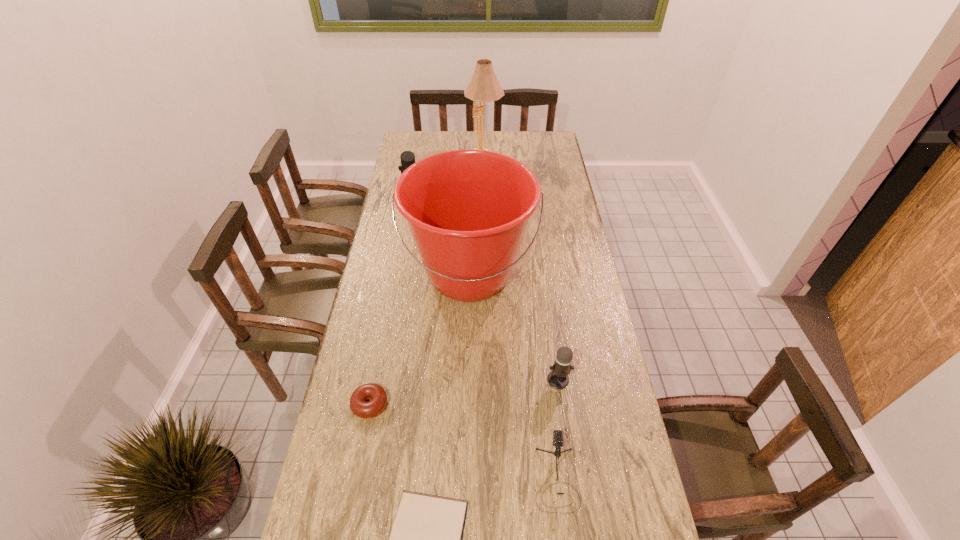
Locate an element on the screen. This screenshot has width=960, height=540. the tallest object is located at coordinates (483, 87).

Image resolution: width=960 pixels, height=540 pixels. I want to click on the farthest object, so click(483, 87).

At what (x,y) coordinates should I click in order to perform the action: click on the second tallest object. Please return your answer as a coordinate pair (x, y). Looking at the image, I should click on (467, 210).

Identify the location of the fifth nearest object. (467, 210).

At what (x,y) coordinates should I click in order to perform the action: click on the sixth nearest object. Please return your answer as a coordinate pair (x, y). Image resolution: width=960 pixels, height=540 pixels. Looking at the image, I should click on (407, 158).

Where is `the tallest microphone`? This screenshot has width=960, height=540. the tallest microphone is located at coordinates (407, 158).

You are a GUI agent. You are given a task and a screenshot of the screen. Output one action in this format:
    pyautogui.click(x=<x>, y=<y>)
    Task: Click on the fourth shortest object
    
    Given the screenshot: What is the action you would take?
    pyautogui.click(x=557, y=378)

Locate an element on the screen. the second nearest microphone is located at coordinates (557, 378).

At what (x,y) coordinates should I click in order to perform the action: click on the nearest microphone. Please return your answer as a coordinate pair (x, y). Looking at the image, I should click on (557, 434).

Find the location of `the third shortest object`. the third shortest object is located at coordinates (557, 434).